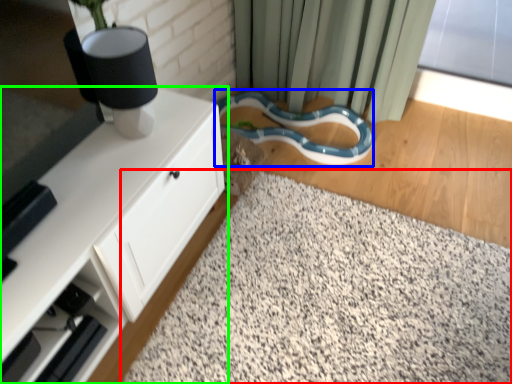
Question: Which object is positioned farthest from gravel (highlighted by a red box)? Select from snake (highlighted by a blue box) and cabinetry (highlighted by a green box).

Choices:
 (A) snake
 (B) cabinetry

Answer: (A)